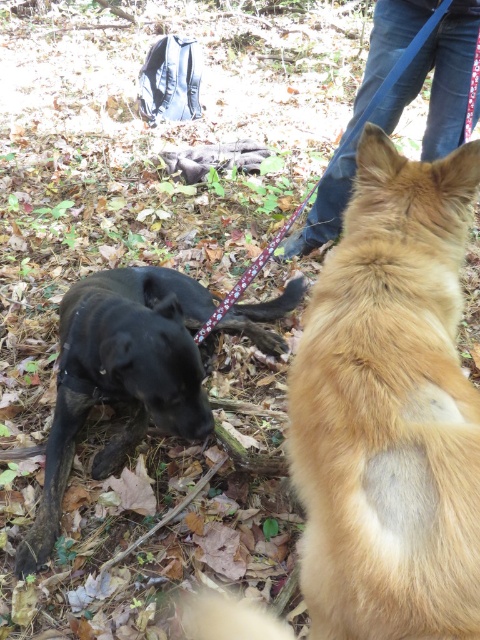
Between fuzzy golden dog at right and shiny black dog at lower left, which one has less height?

shiny black dog at lower left is shorter.

Between fuzzy golden dog at right and shiny black dog at lower left, which one has more height?

fuzzy golden dog at right

Locate an element on the screen. fuzzy golden dog at right is located at coordinates (389, 410).